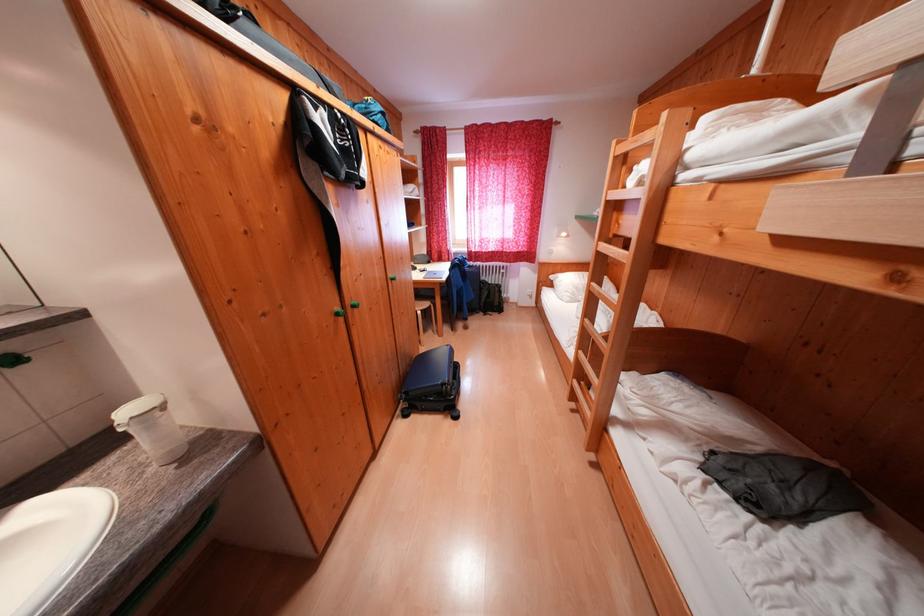
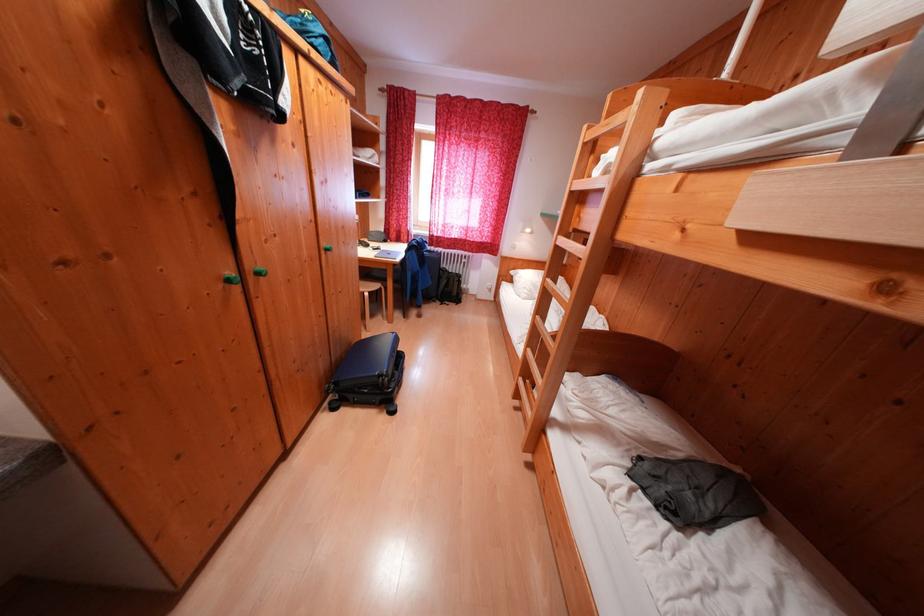
Find the pixel in the second image that matches (x=560, y=289) in the first image.

(518, 284)